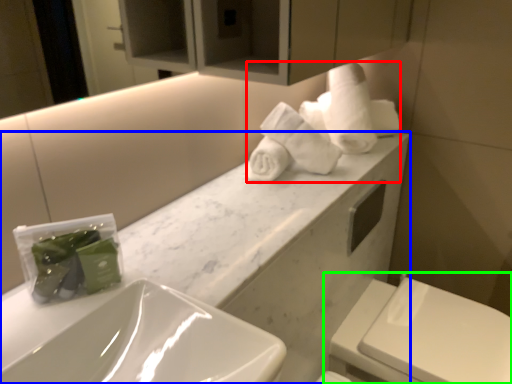
Question: Which object is positioned farthest from bath towel (highlighted by a red box)? Select from porcelain (highlighted by a blue box) and toilet (highlighted by a green box).

Choices:
 (A) porcelain
 (B) toilet

Answer: (B)